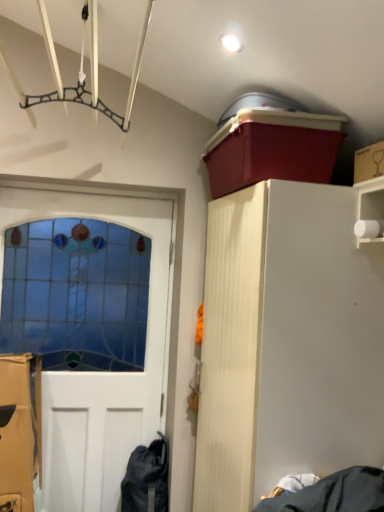
Question: Is white wood cabinet at upper right wider or thinner than cardboard box at upper right?

Choices:
 (A) thin
 (B) wide

Answer: (B)

Question: From the image's perspective, is white wood cabinet at upper right above or below cardboard box at upper right?

Choices:
 (A) above
 (B) below

Answer: (B)

Question: Which object is the farthest from the matte plastic storage bin at upper right?

Choices:
 (A) stained glass door at left
 (B) cardboard box at upper right
 (C) white wood cabinet at upper right

Answer: (A)

Question: Estimate the real-world distances between objects in this image. Which object is farther from the white wood cabinet at upper right?

Choices:
 (A) cardboard box at upper right
 (B) stained glass door at left
 (C) matte plastic storage bin at upper right

Answer: (B)